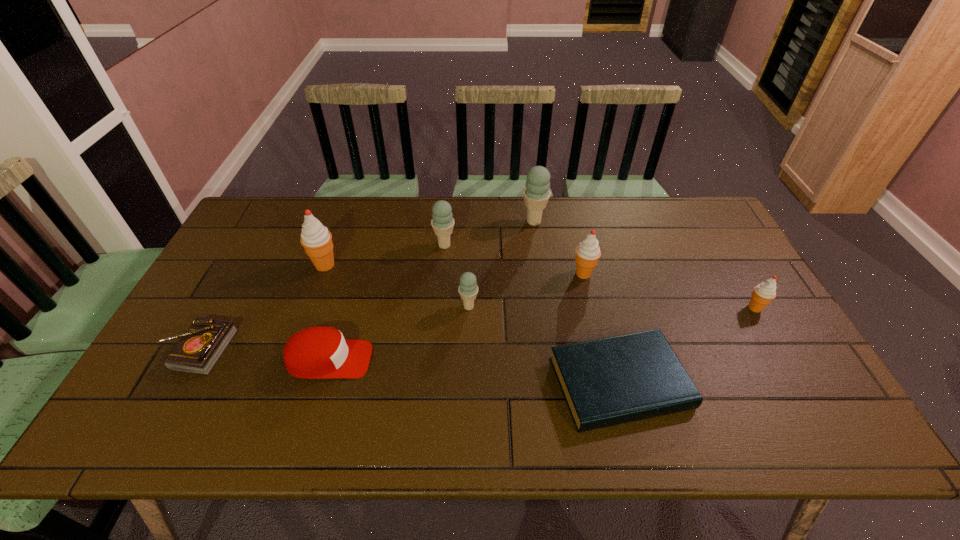
Identify the location of free space between the blue book and the second red icecream from right to left. This screenshot has height=540, width=960. (602, 328).

Locate an element on the screen. This screenshot has width=960, height=540. unoccupied position between the biggest blue ice cream and the nearest red icecream is located at coordinates (644, 265).

What are the coordinates of `free space between the leftmost object and the third shortest object` in the screenshot? It's located at (264, 355).

Find the location of a particular element. The width and height of the screenshot is (960, 540). empty space that is in between the fifth ice cream from right to left and the blue book is located at coordinates (532, 314).

Choose which object is the fourth nearest neighbor to the book. Please provide its 2D coordinates. Your answer should be formatted as a tuple, i.e. [(x, y)], where the tuple contains the x and y coordinates of a point satisfying the conditions above.

[(442, 223)]

Find the location of a particular element. The width and height of the screenshot is (960, 540). object that ranks as the third closest to the nearest red icecream is located at coordinates (536, 194).

Where is `the second closest ice cream to the biggest blue ice cream`? The width and height of the screenshot is (960, 540). the second closest ice cream to the biggest blue ice cream is located at coordinates (442, 223).

This screenshot has width=960, height=540. Find the location of `the fourth closest ice cream relative to the biggest red icecream`. the fourth closest ice cream relative to the biggest red icecream is located at coordinates (588, 252).

Image resolution: width=960 pixels, height=540 pixels. What are the coordinates of `blue ice cream that is the closest to the second blue ice cream from right to left` in the screenshot? It's located at (x=442, y=223).

At what (x,y) coordinates should I click in order to perform the action: click on blue ice cream that is the second closest to the second red icecream from left to right. Please return your answer as a coordinate pair (x, y). The image size is (960, 540). Looking at the image, I should click on (468, 289).